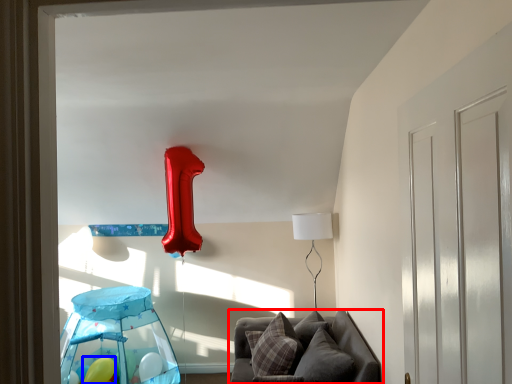
Question: Which object appears farthest to the camera in this image, furniture (highlighted by a red box) or balloon (highlighted by a blue box)?

Choices:
 (A) furniture
 (B) balloon

Answer: (B)